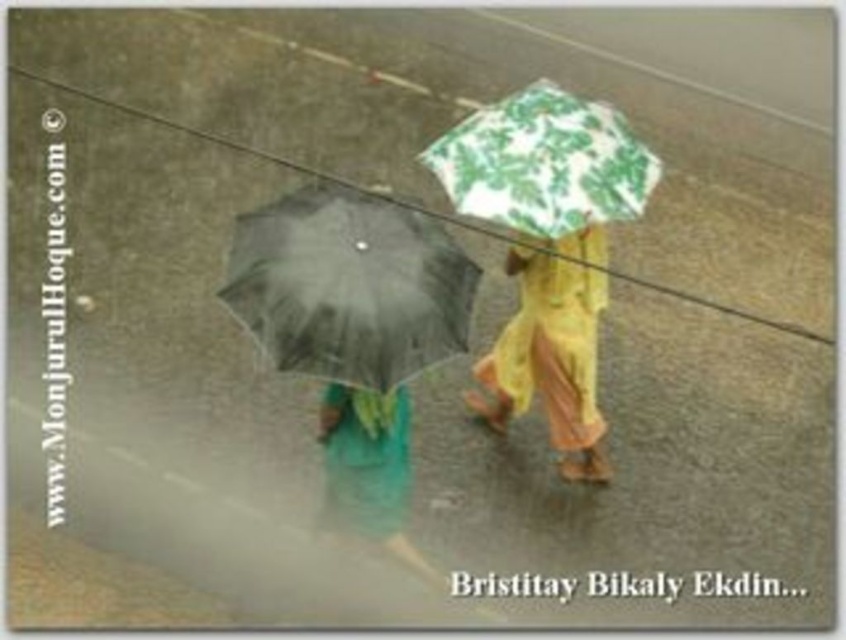
Question: Is green printed umbrella at upper center above green fabric bag at lower center?

Choices:
 (A) yes
 (B) no

Answer: (A)

Question: Is green printed umbrella at upper center in front of yellow fabric umbrella at upper center?

Choices:
 (A) yes
 (B) no

Answer: (A)

Question: Does green printed umbrella at upper center appear over yellow fabric umbrella at upper center?

Choices:
 (A) yes
 (B) no

Answer: (A)

Question: Which point appears farthest from the camera in this image?

Choices:
 (A) (305, 252)
 (B) (383, 499)

Answer: (B)

Question: Among these objects, which one is nearest to the camera?

Choices:
 (A) black matte umbrella at left
 (B) green printed umbrella at upper center
 (C) green fabric bag at lower center

Answer: (A)

Question: Which of the following is the farthest from the observer?

Choices:
 (A) (490, 124)
 (B) (350, 433)
 (C) (423, 346)

Answer: (A)